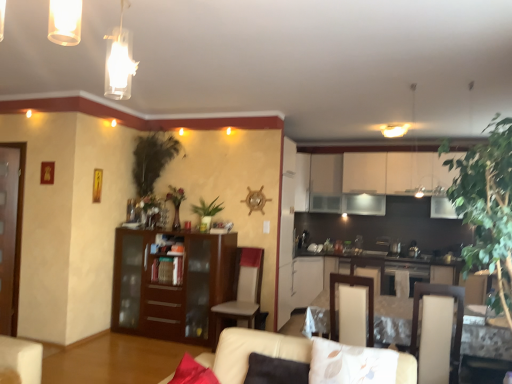
Question: From a real-world perspective, relative to dark brown wood cabinet at center, is black stainless steel oven at center vertically above or below?

Choices:
 (A) below
 (B) above

Answer: (A)

Question: Looking at the image, does black stainless steel oven at center seem bigger or smaller compared to dark brown wood cabinet at center?

Choices:
 (A) big
 (B) small

Answer: (B)

Question: Which is farther from the light gray fabric chair at center?

Choices:
 (A) green leafy plant at right, acting as the 1th plant starting from the front
 (B) white glossy table at lower right
 (C) dark brown wood cabinet at center
 (D) black stainless steel oven at center
 (E) green leafy plant at upper left, the 1th plant positioned from the left

Answer: (A)

Question: Which object is positioned farthest from the floral fabric pillow at center?

Choices:
 (A) beige leather couch at lower center
 (B) light gray fabric chair at center
 (C) green leafy plant at right, acting as the 1th plant starting from the front
 (D) green leafy plant at center, the second plant in the left-to-right sequence
 (E) beige leather armchair at center

Answer: (D)